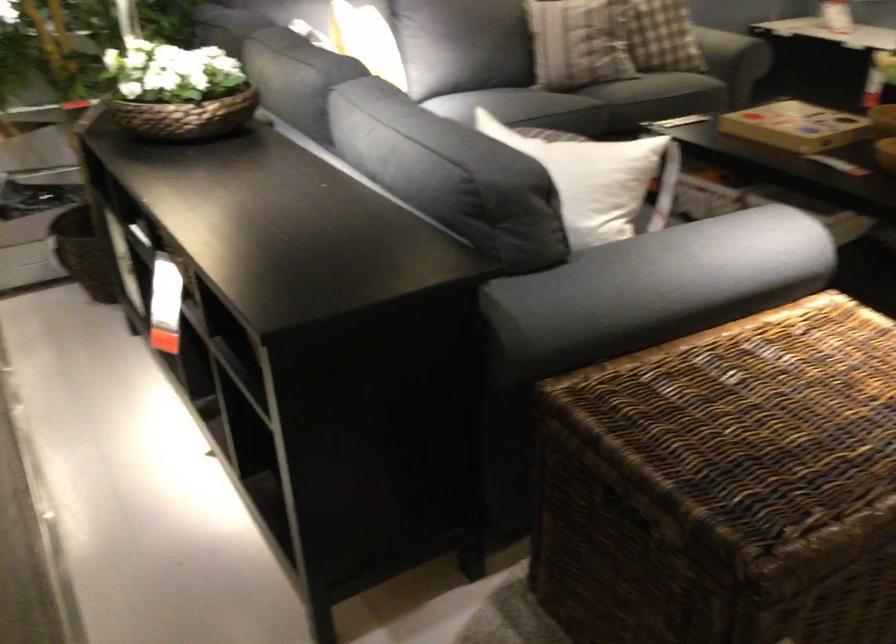
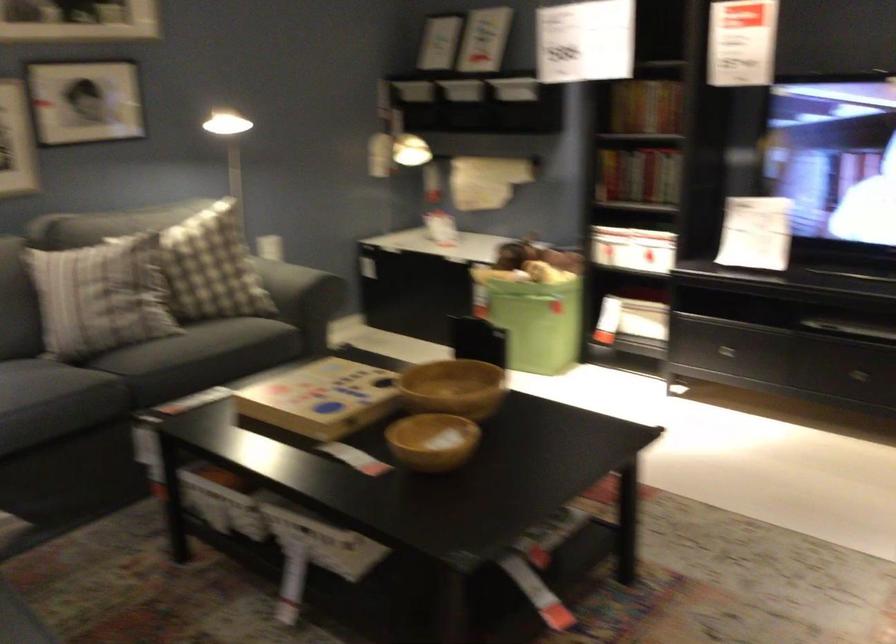
Where in the second image is the point corresponding to pixel 684 88 from the first image?

(199, 357)